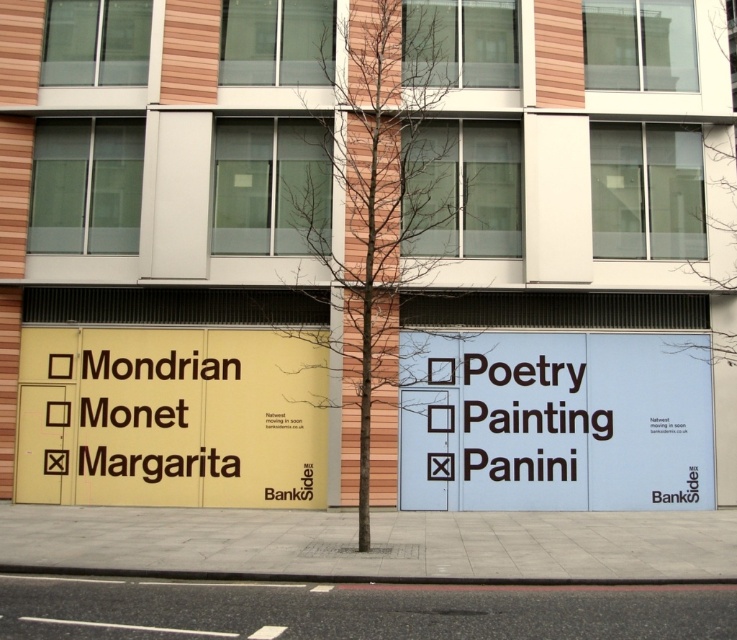
Describe the element at coordinates (556, 422) in the screenshot. I see `white paper sign at center` at that location.

Which is behind, point (713, 456) or point (88, 328)?

Point (88, 328)

Is point (597, 474) positioned in front of point (97, 344)?

Yes, it is in front of point (97, 344).

The image size is (737, 640). Find the location of `white paper sign at center`. white paper sign at center is located at coordinates (556, 422).